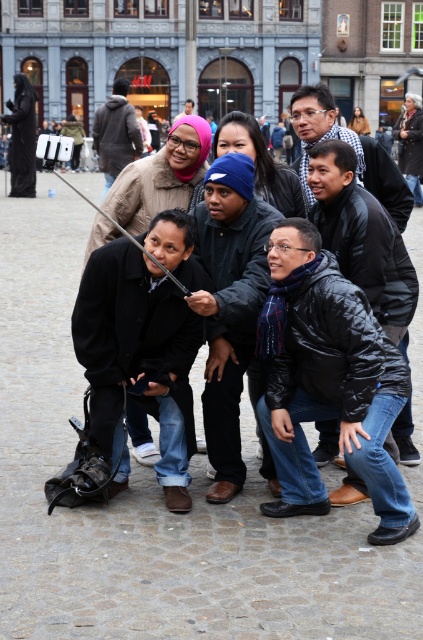
You are a photographer trying to adjust the lighting for a group photo in a European square. The group is wearing winter clothes and using a selfie stick. There is a point at coordinates (x=362, y=236) which is the center of the black quilted jacket. If you want to ensure the black quilted jacket at center is well lit, where should you position the light source relative to this point?

The light source should be positioned in a way that it illuminates the black quilted jacket at center effectively. Since the point (x=362, y=236) corresponds to the jacket, placing the light source directly in front or slightly to the side of this point would ensure proper lighting, avoiding harsh shadows.

You are standing in the public square where the group is taking a photo. You want to know which of the two points, point (354, 236) or point (150, 252), is closer to you. Can you determine this based on their positions?

Point (354, 236) is further to the camera than point (150, 252), so the point closer to you is point (150, 252).

You are part of the group in the photo and want to know which of the two points, point (351, 172) or point (107, 180), is closer to you. Can you determine this based on their positions?

Point (351, 172) is closer to the camera than point (107, 180).